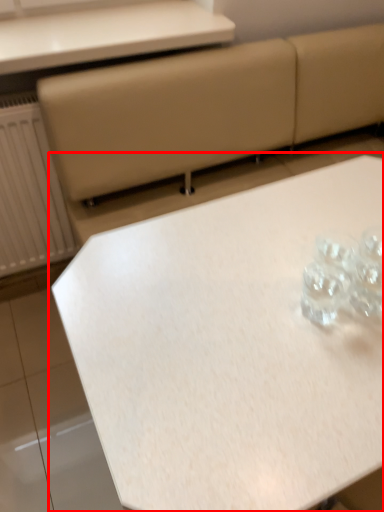
Question: From the image's perspective, what is the correct spatial relationship of table (annotated by the red box) in relation to table?

Choices:
 (A) below
 (B) above

Answer: (A)